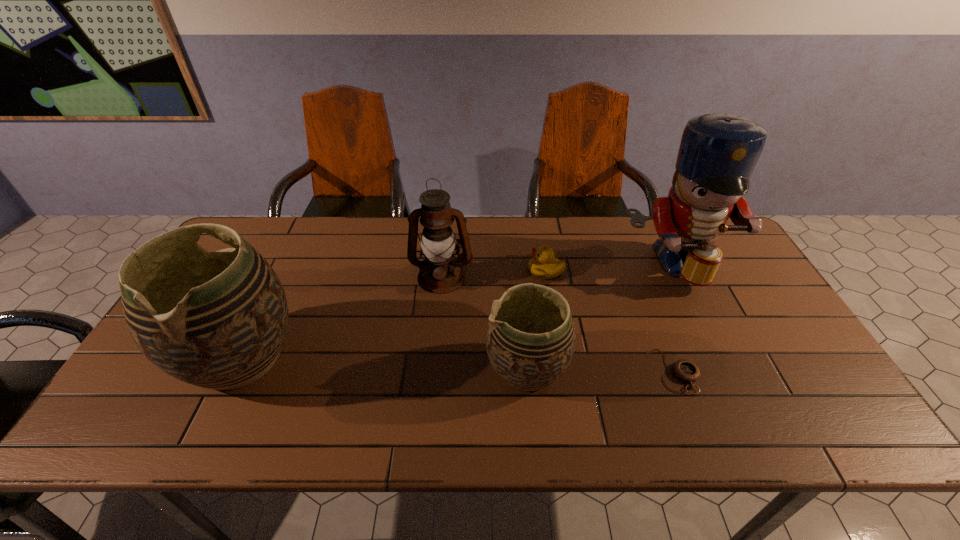
Identify the location of the taller pottery. (218, 320).

Where is `the left pottery`? the left pottery is located at coordinates (218, 320).

In order to click on the third shortest object in this screenshot , I will do `click(530, 340)`.

Locate an element on the screen. Image resolution: width=960 pixels, height=540 pixels. the shorter pottery is located at coordinates (530, 340).

This screenshot has height=540, width=960. I want to click on the tallest object, so pyautogui.click(x=718, y=152).

Where is `duckling`? This screenshot has height=540, width=960. duckling is located at coordinates (543, 265).

Where is `lantern`? lantern is located at coordinates (437, 241).

Find the location of a particular element. The image size is (960, 540). pocket watch is located at coordinates click(685, 370).

Locate an element on the screen. free location located on the back of the left pottery is located at coordinates (291, 254).

This screenshot has height=540, width=960. What are the coordinates of `free spot located on the right of the shorter pottery` in the screenshot? It's located at (612, 369).